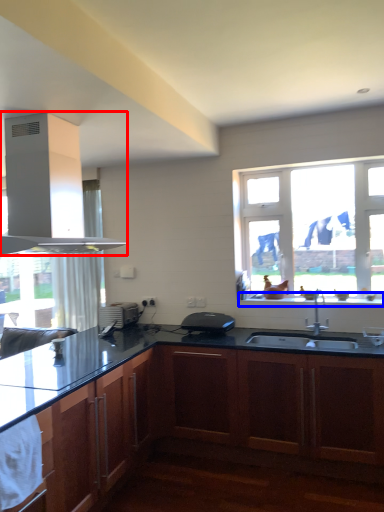
Question: Which of the following is the farthest to the observer, gas stove (highlighted by a red box) or window sill (highlighted by a blue box)?

Choices:
 (A) gas stove
 (B) window sill

Answer: (B)